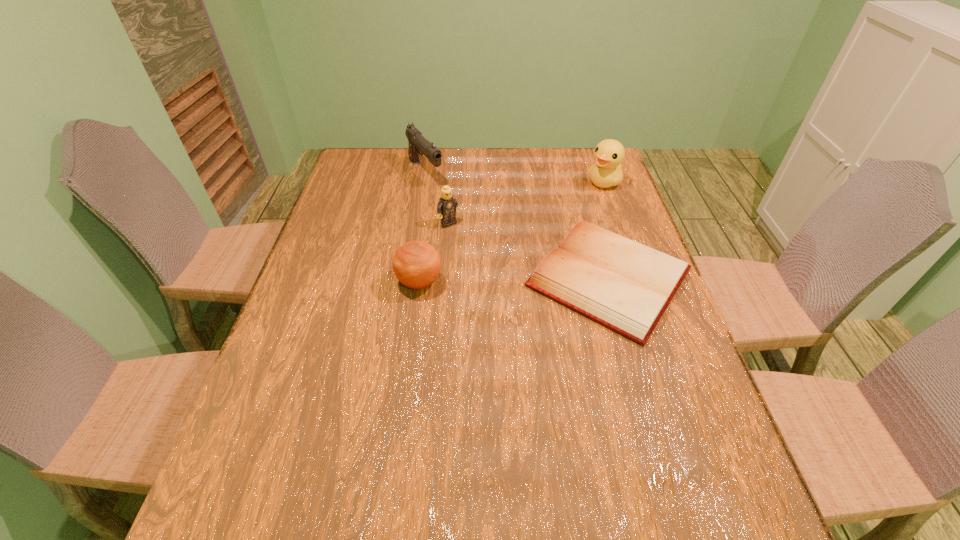
Identify the location of free spot between the gun and the shortest object. [x=517, y=225].

In order to click on vacant point located between the duck and the gun in this screenshot , I will do `click(515, 177)`.

Locate an element on the screen. free space that is in between the Bible and the gun is located at coordinates (517, 225).

The height and width of the screenshot is (540, 960). I want to click on free space between the orange and the gun, so click(x=422, y=227).

Locate an element on the screen. Image resolution: width=960 pixels, height=540 pixels. the fourth closest object to the Bible is located at coordinates tap(418, 144).

The height and width of the screenshot is (540, 960). I want to click on the third closest object to the orange, so click(418, 144).

Locate an element on the screen. The image size is (960, 540). vacant space that satisfies the following two spatial constraints: 1. on the front side of the gun; 2. on the right side of the Lego is located at coordinates (417, 224).

Find the location of a particular element. free location that satisfies the following two spatial constraints: 1. on the back side of the duck; 2. on the right side of the shortest object is located at coordinates (581, 182).

Locate an element on the screen. This screenshot has width=960, height=540. free point that satisfies the following two spatial constraints: 1. on the front side of the Lego; 2. on the right side of the shortest object is located at coordinates (445, 278).

Where is `vacant space that satisfies the following two spatial constraints: 1. on the front side of the Lego; 2. on the right side of the Bible`? This screenshot has height=540, width=960. vacant space that satisfies the following two spatial constraints: 1. on the front side of the Lego; 2. on the right side of the Bible is located at coordinates (445, 278).